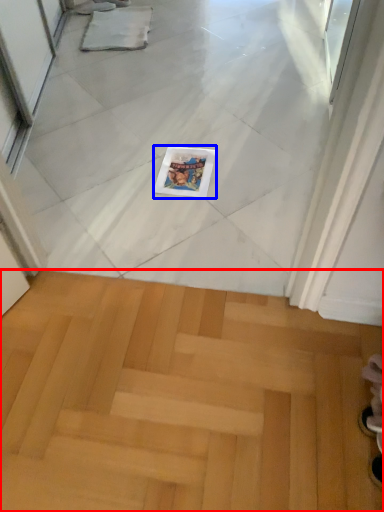
Question: Which object is further to the camera taking this photo, stairwell (highlighted by a red box) or magazine (highlighted by a blue box)?

Choices:
 (A) stairwell
 (B) magazine

Answer: (B)